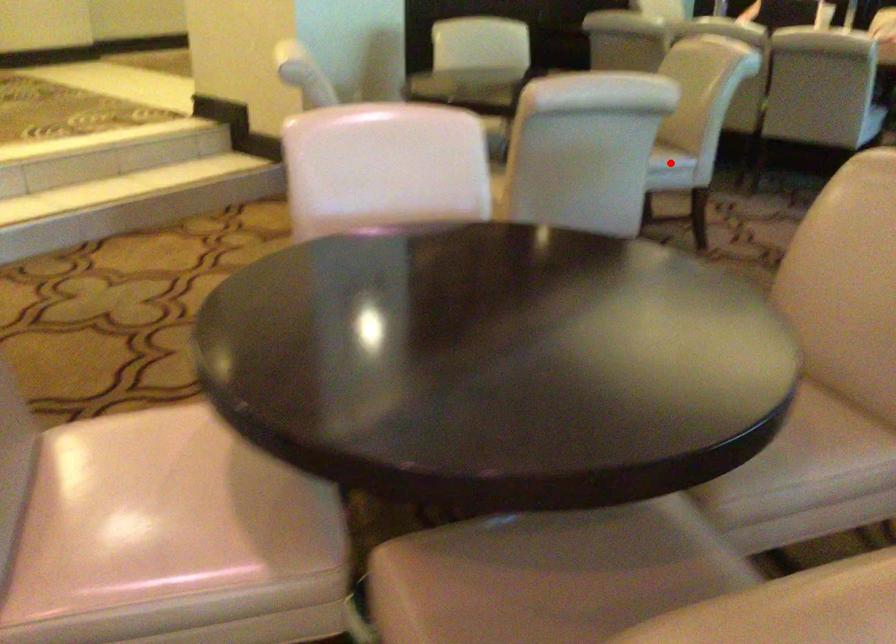
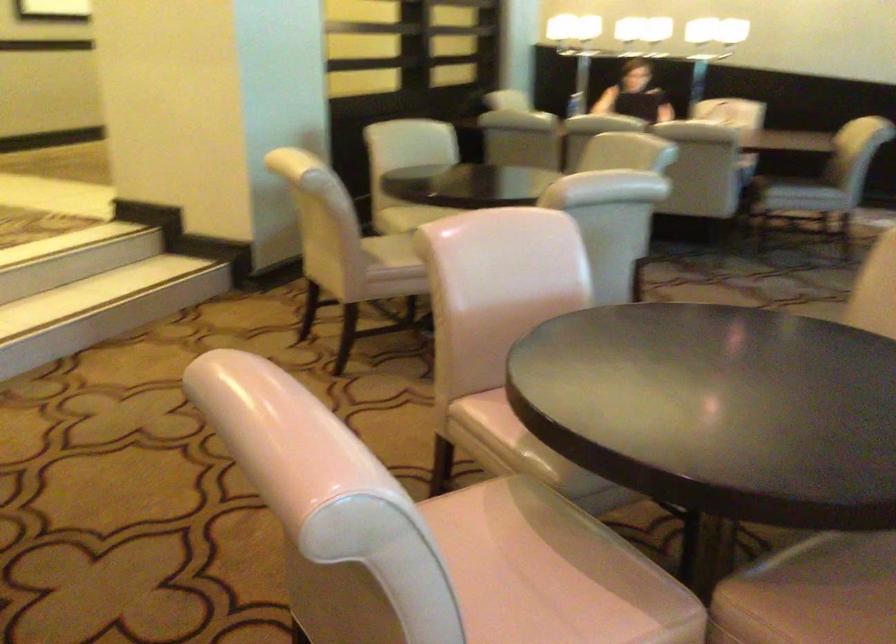
Question: I am providing you with two images of the same scene from different viewpoints. A red point is marked on the first image. At the location where the point appears in image 1, is it still visible in image 2?

Choices:
 (A) Yes
 (B) No

Answer: (B)